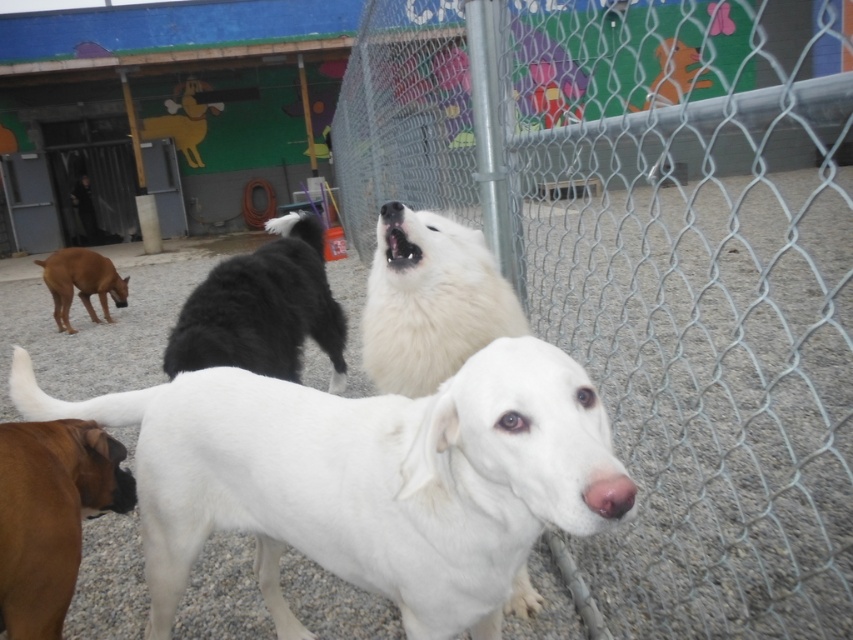
Can you confirm if wire mesh fence at center is bigger than white smooth dog at center?

Yes.

Does wire mesh fence at center appear under white smooth dog at center?

No, wire mesh fence at center is not below white smooth dog at center.

Does point (759, 312) come behind point (543, 444)?

That is True.

The width and height of the screenshot is (853, 640). In order to click on wire mesh fence at center in this screenshot , I will do `click(654, 262)`.

Which of these two, white smooth dog at center or brown fur dog at left, stands taller?

white smooth dog at center

Is white smooth dog at center positioned behind brown fur dog at left?

No, it is in front of brown fur dog at left.

Does point (354, 576) come behind point (74, 262)?

No, (354, 576) is closer to viewer.

The height and width of the screenshot is (640, 853). I want to click on white smooth dog at center, so click(366, 480).

Does wire mesh fence at center have a lesser width compared to brown matte dog at lower left?

In fact, wire mesh fence at center might be wider than brown matte dog at lower left.

Based on the photo, is wire mesh fence at center below brown matte dog at lower left?

No, wire mesh fence at center is not below brown matte dog at lower left.

You are a GUI agent. You are given a task and a screenshot of the screen. Output one action in this format:
    pyautogui.click(x=<x>, y=<y>)
    Task: Click on the wire mesh fence at center
    
    Given the screenshot: What is the action you would take?
    pyautogui.click(x=654, y=262)